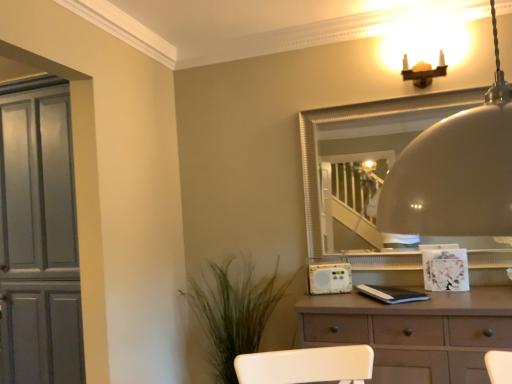
The image size is (512, 384). I want to click on vacant space situated above silver textured mirror at upper center (from a real-world perspective), so click(x=412, y=96).